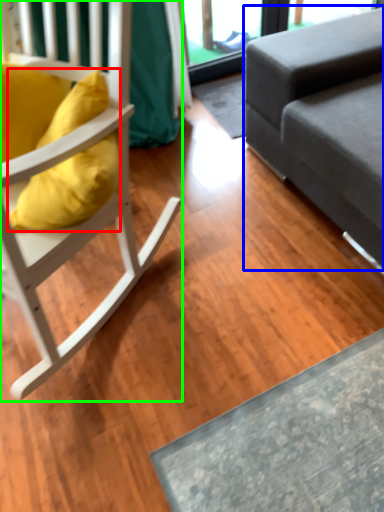
Question: Considering the real-world distances, which object is farthest from pillow (highlighted by a red box)? studio couch (highlighted by a blue box) or chair (highlighted by a green box)?

Choices:
 (A) studio couch
 (B) chair

Answer: (A)